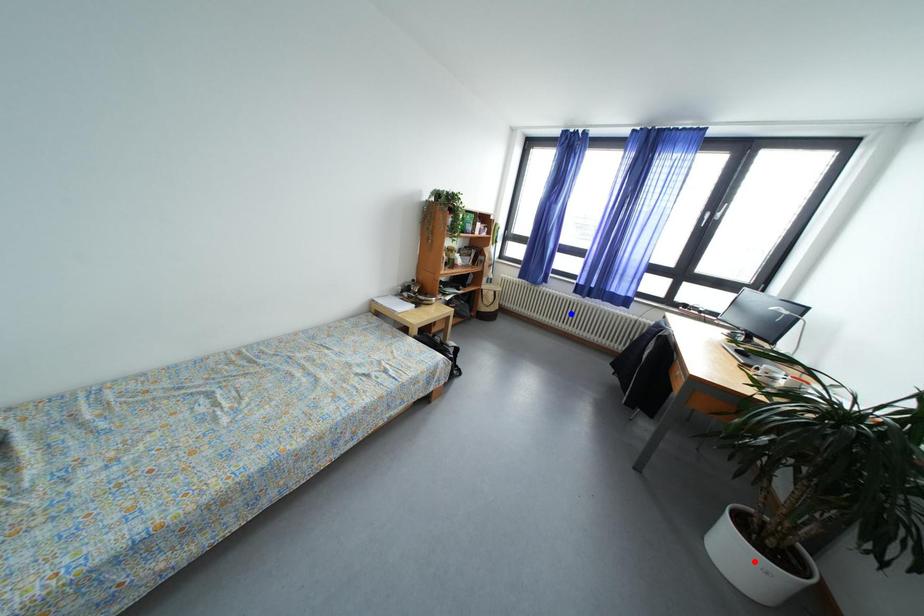
Question: In the image, two points are highlighted. Which point is nearer to the camera? Reply with the corresponding letter.

Choices:
 (A) blue point
 (B) red point

Answer: (B)